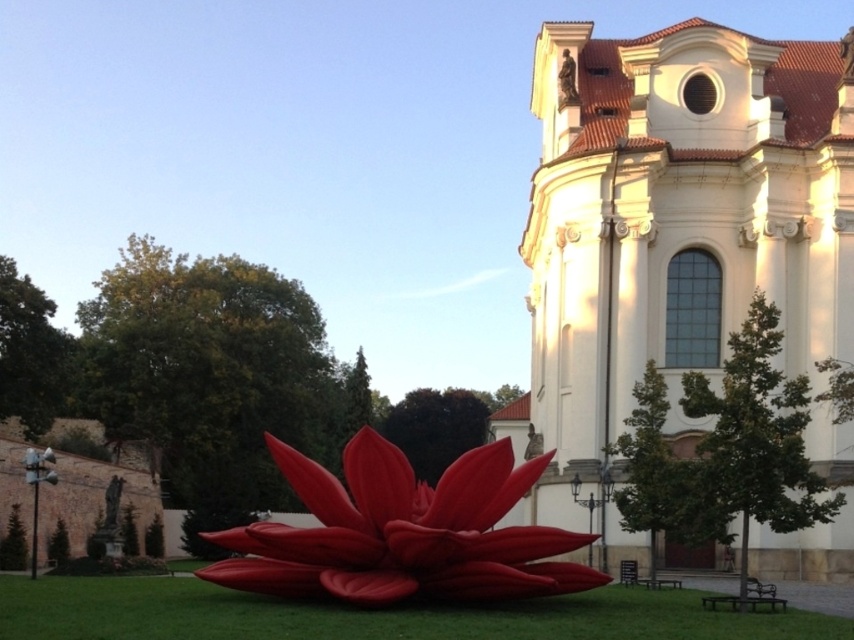
Identify the location of white smooth church at upper right. (676, 225).

Is white smooth church at upper right smaller than matte red flower at center?

No.

Does point (679, 120) lie behind point (457, 560)?

Yes, point (679, 120) is farther from viewer.

Where is `white smooth church at upper right`? The height and width of the screenshot is (640, 854). white smooth church at upper right is located at coordinates (676, 225).

Who is positioned more to the right, matte red flower at center or green grass at lower center?

matte red flower at center

Between matte red flower at center and green grass at lower center, which one has less height?

green grass at lower center

Does point (483, 557) lie behind point (69, 611)?

That is False.

Locate an element on the screen. The width and height of the screenshot is (854, 640). matte red flower at center is located at coordinates (402, 531).

Is white smooth church at upper right to the right of green grass at lower center from the viewer's perspective?

Yes, white smooth church at upper right is to the right of green grass at lower center.

Is point (657, 291) positioned behind point (392, 611)?

That is True.

Find the location of a particular element. white smooth church at upper right is located at coordinates (676, 225).